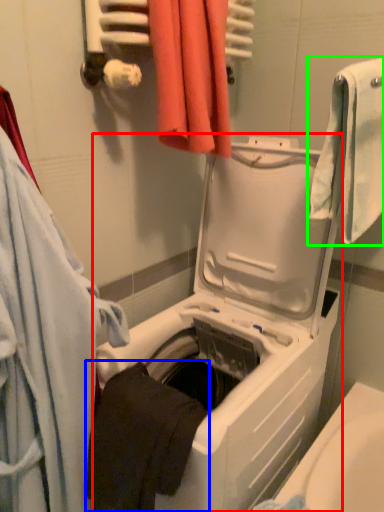
Question: Which object is positioned closest to washing machine (highlighted by a red box)? Select from towel (highlighted by a blue box) and towel (highlighted by a green box).

Choices:
 (A) towel
 (B) towel

Answer: (A)